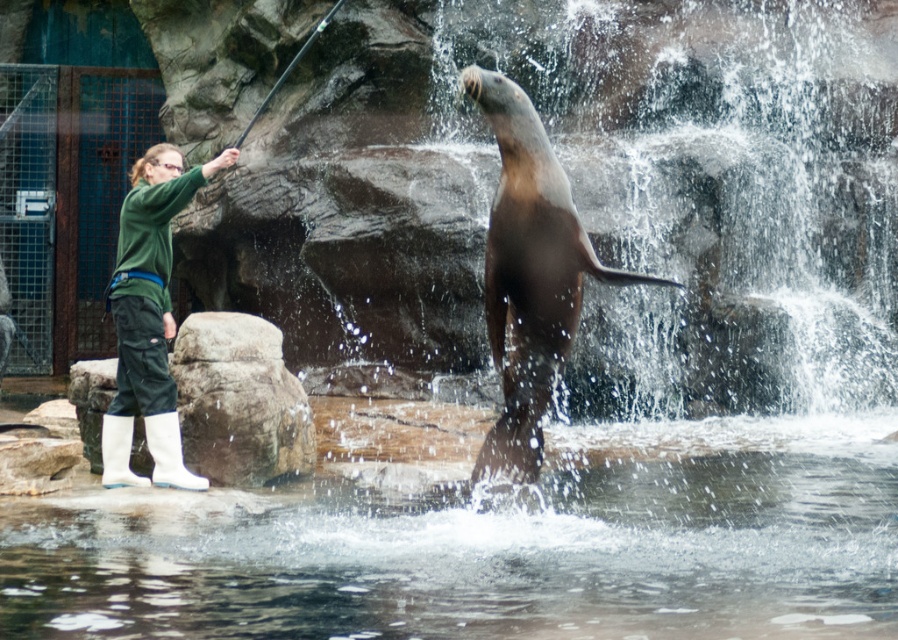
Is point (499, 620) closer to viewer compared to point (248, 337)?

That is True.

Which is more to the left, clear water at lower center or gray rock at center?

gray rock at center

Between point (740, 589) and point (207, 435), which one is positioned in front?

Point (740, 589) is more forward.

Identify the location of clear water at lower center. (489, 548).

Between gray rock at center and green fabric pants at left, which one has more height?

green fabric pants at left

Is gray rock at center wider than green fabric pants at left?

No.

What do you see at coordinates (238, 401) in the screenshot? I see `gray rock at center` at bounding box center [238, 401].

The height and width of the screenshot is (640, 898). I want to click on gray rock at center, so click(238, 401).

Can you confirm if green fabric cage at left is smaller than green fabric pants at left?

Indeed, green fabric cage at left has a smaller size compared to green fabric pants at left.

Can you confirm if green fabric cage at left is wider than green fabric pants at left?

No.

Who is more distant from viewer, (x=25, y=275) or (x=160, y=147)?

The point (x=25, y=275) is more distant.

At what (x,y) coordinates should I click in order to perform the action: click on green fabric cage at left. Please return your answer as a coordinate pair (x, y). The width and height of the screenshot is (898, 640). Looking at the image, I should click on pos(66,200).